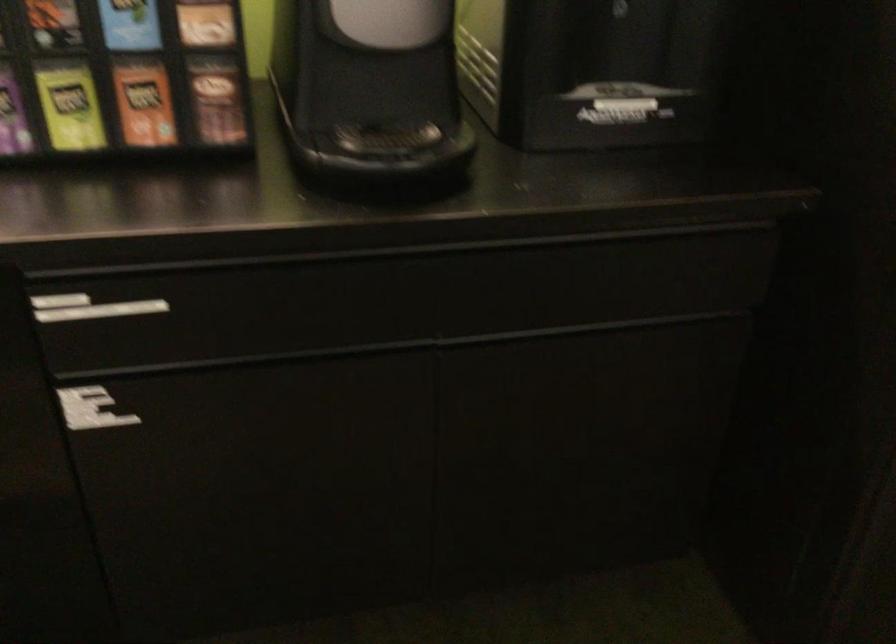
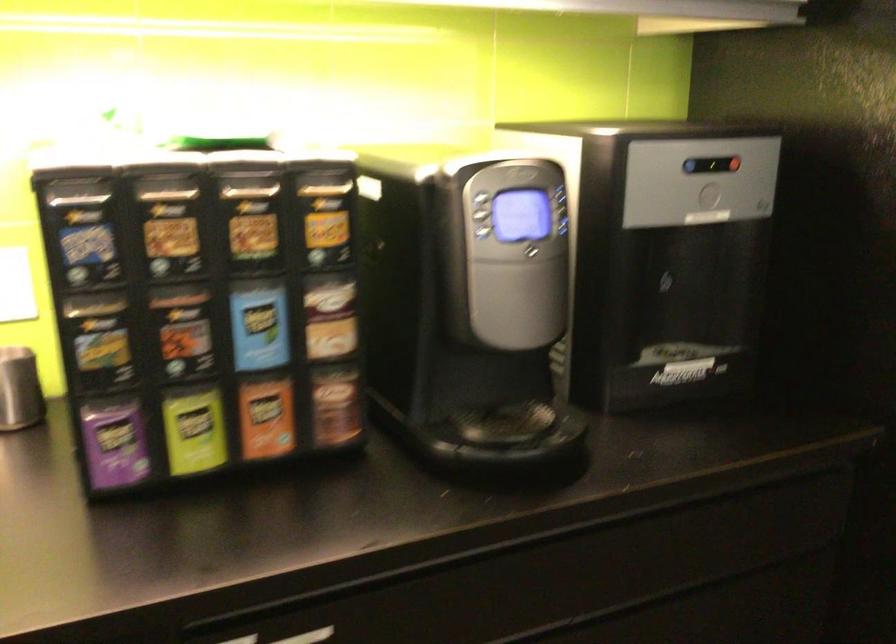
Locate, in the second image, the point that corresponds to point 73,106 in the first image.

(194, 430)